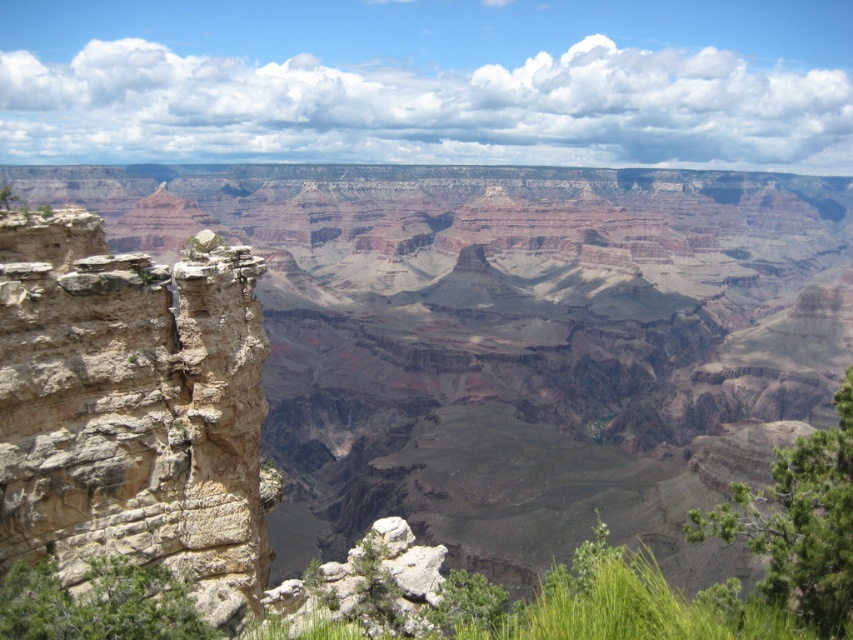
Question: Is brown rocky canyon at left bigger than rustic stone cliff at left?

Choices:
 (A) yes
 (B) no

Answer: (A)

Question: Which object appears farthest from the camera in this image?

Choices:
 (A) brown rocky canyon at left
 (B) rustic stone cliff at left

Answer: (A)

Question: Does brown rocky canyon at left appear over rustic stone cliff at left?

Choices:
 (A) no
 (B) yes

Answer: (B)

Question: Observing the image, what is the correct spatial positioning of brown rocky canyon at left in reference to rustic stone cliff at left?

Choices:
 (A) right
 (B) left

Answer: (A)